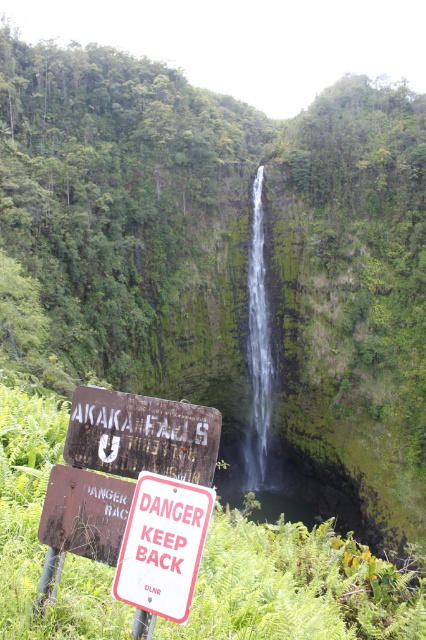
Based on the photo, you are a park ranger at Akaka Falls and need to place a new sign that is 18 inches wide between the rusty wood sign at lower center and the red plastic sign at lower center. Can the new sign fit between them?

The distance between the rusty wood sign at lower center and the red plastic sign at lower center is 19.70 inches, so the 18 inch wide sign can fit between them.

You are a hiker planning to cross the narrow wooden bridge near the Akaka Falls. You see two warning signs at the lower center of your view. Which sign is closer to you, the rusty wood sign at lower center or the red plastic sign at lower center?

The rusty wood sign at lower center is closer to you because the red plastic sign at lower center is behind it.